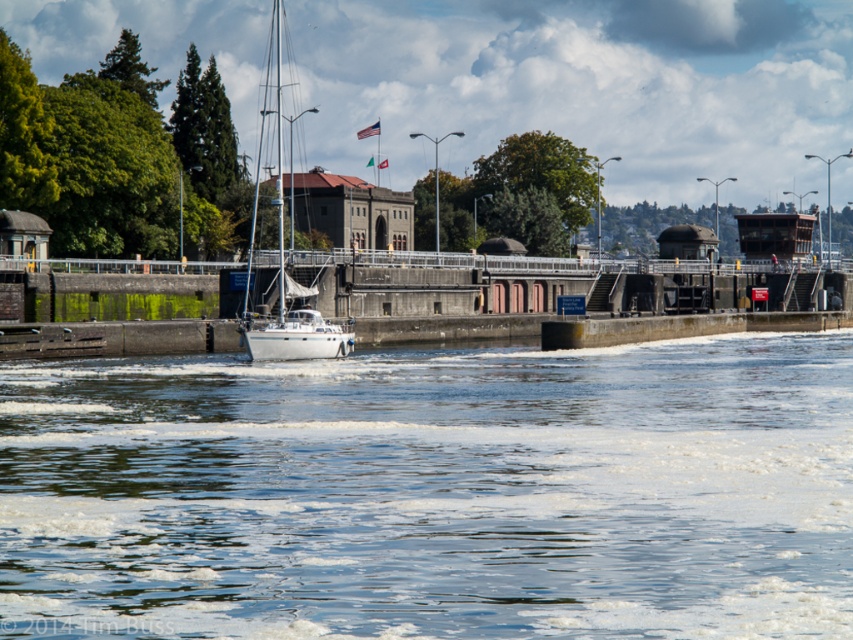
You are a sailor on the white matte sailboat at center and want to know if the clear water at center is deep enough for your boat to pass through. Based on the scene, can you determine if the water depth is sufficient?

The clear water at center has a lesser height compared to the white matte sailboat at center, which suggests that the water depth may not be sufficient for the boat to pass through safely.

You are standing at the edge of the waterfront scene. There is a point marked at coordinates point (433, 492). What is located at this point?

The point (433, 492) marks the location of clear water at center.

You are a photographer standing at the edge of the waterfront scene. You want to take a photo that includes both point (663, 532) and point (277, 122). Which point will appear larger in your photo?

Point (663, 532) will appear larger in the photo because it is closer to the camera than point (277, 122).